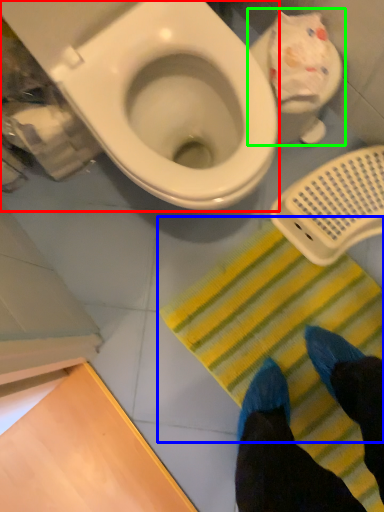
Question: Estimate the real-world distances between objects in this image. Which object is closer to toilet (highlighted by a red box), doormat (highlighted by a blue box) or toilet (highlighted by a green box)?

Choices:
 (A) doormat
 (B) toilet

Answer: (B)